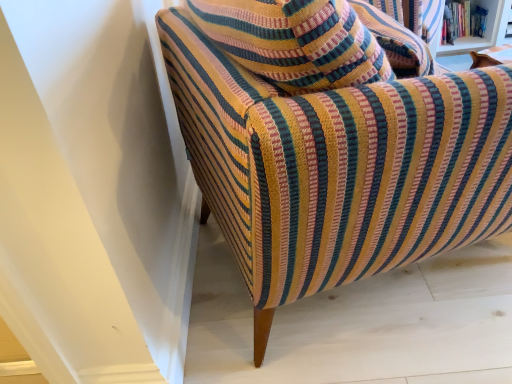
You are a GUI agent. You are given a task and a screenshot of the screen. Output one action in this format:
    pyautogui.click(x=<x>, y=<y>)
    Task: Click on the hardcover book at upper right
    
    Given the screenshot: What is the action you would take?
    (462, 21)

Describe the element at coordinates (462, 21) in the screenshot. I see `hardcover book at upper right` at that location.

Describe the element at coordinates (338, 168) in the screenshot. I see `textured striped armchair at center` at that location.

You are a GUI agent. You are given a task and a screenshot of the screen. Output one action in this format:
    pyautogui.click(x=<x>, y=<y>)
    Task: Click on the textured striped armchair at center
    The width and height of the screenshot is (512, 384).
    Given the screenshot: What is the action you would take?
    pyautogui.click(x=338, y=168)

Identify the location of hardcover book at upper right. (462, 21).

Does hardcover book at upper right appear on the left side of textured striped armchair at center?

No.

In the image, is hardcover book at upper right positioned in front of or behind textured striped armchair at center?

hardcover book at upper right is behind textured striped armchair at center.

Does point (474, 30) come farther from viewer compared to point (465, 219)?

That is True.

From the image's perspective, relative to textured striped armchair at center, is hardcover book at upper right above or below?

hardcover book at upper right is situated higher than textured striped armchair at center in the image.

From a real-world perspective, between hardcover book at upper right and textured striped armchair at center, who is vertically higher?

From a 3D spatial view, textured striped armchair at center is above.

Is hardcover book at upper right wider or thinner than textured striped armchair at center?

In the image, hardcover book at upper right appears to be more narrow than textured striped armchair at center.

Does hardcover book at upper right have a greater height compared to textured striped armchair at center?

Incorrect, the height of hardcover book at upper right is not larger of that of textured striped armchair at center.

Can you confirm if hardcover book at upper right is bigger than textured striped armchair at center?

Incorrect, hardcover book at upper right is not larger than textured striped armchair at center.

Does hardcover book at upper right contain textured striped armchair at center?

That's incorrect, textured striped armchair at center is not inside hardcover book at upper right.

From the picture: Are hardcover book at upper right and textured striped armchair at center located far from each other?

Indeed, hardcover book at upper right is not near textured striped armchair at center.

Is hardcover book at upper right turned away from textured striped armchair at center?

No, hardcover book at upper right's orientation is not away from textured striped armchair at center.

Can you tell me how much hardcover book at upper right and textured striped armchair at center differ in facing direction?

The angle between the facing direction of hardcover book at upper right and the facing direction of textured striped armchair at center is 110 degrees.

Where is `chair in front of the hardcover book at upper right`? The image size is (512, 384). chair in front of the hardcover book at upper right is located at coordinates (338, 168).

From the picture: Considering the positions of objects textured striped armchair at center and hardcover book at upper right in the image provided, who is more to the right, textured striped armchair at center or hardcover book at upper right?

hardcover book at upper right is more to the right.

Does textured striped armchair at center come in front of hardcover book at upper right?

Yes, textured striped armchair at center is closer to the camera.

Is point (207, 118) closer to viewer compared to point (471, 5)?

Yes, point (207, 118) is in front of point (471, 5).

From the image's perspective, is textured striped armchair at center above or below hardcover book at upper right?

textured striped armchair at center is situated lower than hardcover book at upper right in the image.

From a real-world perspective, does textured striped armchair at center sit lower than hardcover book at upper right?

Actually, textured striped armchair at center is physically above hardcover book at upper right in the real world.

Between textured striped armchair at center and hardcover book at upper right, which one has smaller width?

hardcover book at upper right is thinner.

Considering the relative sizes of textured striped armchair at center and hardcover book at upper right in the image provided, is textured striped armchair at center taller than hardcover book at upper right?

Yes, textured striped armchair at center is taller than hardcover book at upper right.

Which of these two, textured striped armchair at center or hardcover book at upper right, is bigger?

With larger size is textured striped armchair at center.

Is textured striped armchair at center outside of hardcover book at upper right?

That's correct, textured striped armchair at center is outside of hardcover book at upper right.

Is textured striped armchair at center far from hardcover book at upper right?

Yes, textured striped armchair at center and hardcover book at upper right are quite far apart.

Is textured striped armchair at center oriented towards hardcover book at upper right?

No, textured striped armchair at center is not oriented towards hardcover book at upper right.

What's the angular difference between textured striped armchair at center and hardcover book at upper right's facing directions?

The angle between the facing direction of textured striped armchair at center and the facing direction of hardcover book at upper right is 110 degrees.

This screenshot has width=512, height=384. There is a hardcover book at upper right. Identify the location of chair above it (from a real-world perspective). (338, 168).

You are a GUI agent. You are given a task and a screenshot of the screen. Output one action in this format:
    pyautogui.click(x=<x>, y=<y>)
    Task: Click on the chair above the hardcover book at upper right (from a real-world perspective)
    Image resolution: width=512 pixels, height=384 pixels.
    Given the screenshot: What is the action you would take?
    pyautogui.click(x=338, y=168)

This screenshot has height=384, width=512. In the image, there is a hardcover book at upper right. Identify the location of chair below it (from the image's perspective). (338, 168).